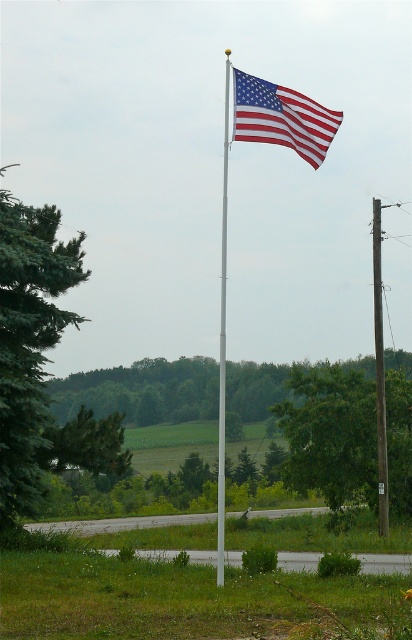
Can you confirm if red/white striped fabric flag at upper center is positioned below smooth gray pole at center?

A: Actually, red/white striped fabric flag at upper center is above smooth gray pole at center.

Can you confirm if red/white striped fabric flag at upper center is bigger than smooth gray pole at center?

Incorrect, red/white striped fabric flag at upper center is not larger than smooth gray pole at center.

The image size is (412, 640). What do you see at coordinates (281, 116) in the screenshot?
I see `red/white striped fabric flag at upper center` at bounding box center [281, 116].

Find the location of a particular element. This screenshot has height=640, width=412. red/white striped fabric flag at upper center is located at coordinates (281, 116).

Is point (220, 502) positioned before point (379, 216)?

Yes, point (220, 502) is closer to viewer.

Is metallic silver flag pole at center to the right of smooth gray pole at center from the viewer's perspective?

In fact, metallic silver flag pole at center is to the left of smooth gray pole at center.

Which is in front, point (224, 292) or point (383, 380)?

Point (383, 380) is more forward.

Where is `metallic silver flag pole at center`? Image resolution: width=412 pixels, height=640 pixels. metallic silver flag pole at center is located at coordinates (222, 342).

Does green coniferous tree at left appear on the left side of red/white striped fabric flag at upper center?

Correct, you'll find green coniferous tree at left to the left of red/white striped fabric flag at upper center.

Who is positioned more to the right, green coniferous tree at left or red/white striped fabric flag at upper center?

red/white striped fabric flag at upper center

This screenshot has height=640, width=412. Identify the location of green coniferous tree at left. (28, 342).

Locate an element on the screen. green coniferous tree at left is located at coordinates (28, 342).